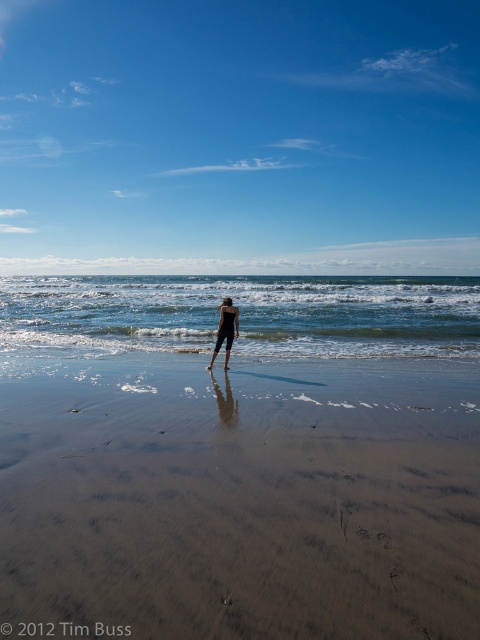
Does sandy brown at lower center have a lesser height compared to blue water at lower center?

Correct, sandy brown at lower center is not as tall as blue water at lower center.

Does sandy brown at lower center have a lesser width compared to blue water at lower center?

Indeed, sandy brown at lower center has a lesser width compared to blue water at lower center.

Is point (360, 428) closer to camera compared to point (291, 340)?

That is True.

This screenshot has height=640, width=480. I want to click on sandy brown at lower center, so click(x=242, y=499).

Does blue water at lower center have a greater width compared to black matte swimsuit at center?

Yes.

Which is more to the left, blue water at lower center or black matte swimsuit at center?

From the viewer's perspective, blue water at lower center appears more on the left side.

Locate an element on the screen. blue water at lower center is located at coordinates (242, 314).

Who is taller, sandy brown at lower center or black matte swimsuit at center?

black matte swimsuit at center

Consider the image. Does sandy brown at lower center have a smaller size compared to black matte swimsuit at center?

Actually, sandy brown at lower center might be larger than black matte swimsuit at center.

Who is more distant from viewer, (255,616) or (227,320)?

Point (227,320)

Find the location of a particular element. sandy brown at lower center is located at coordinates (242, 499).